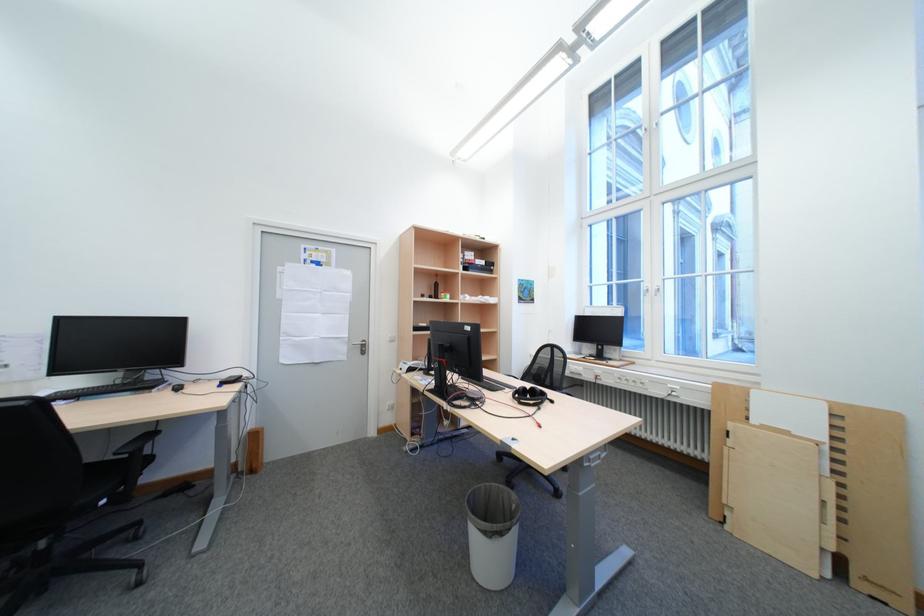
Find the location of `white light switch`. white light switch is located at coordinates (391, 338).